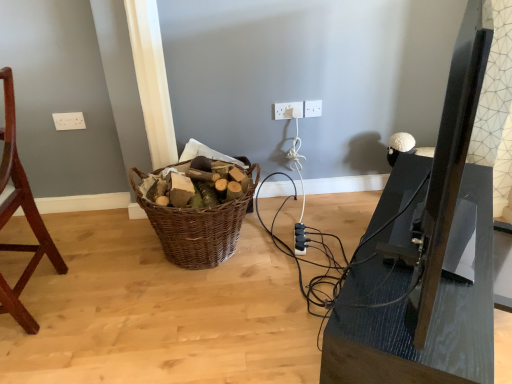
You are a GUI agent. You are given a task and a screenshot of the screen. Output one action in this format:
    pyautogui.click(x=<x>, y=<y>)
    Task: Click on the vacant space to the right of woven brown basket at center
    This screenshot has width=512, height=384.
    Given the screenshot: What is the action you would take?
    pyautogui.click(x=300, y=243)